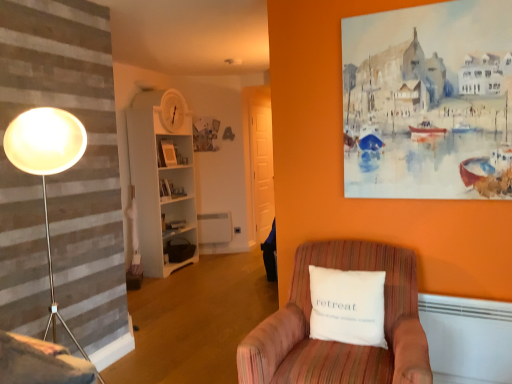
What is the approximate width of white soft cushion at center?

white soft cushion at center is 6.35 inches in width.

What do you see at coordinates (39, 362) in the screenshot? This screenshot has height=384, width=512. I see `velvet pink swivel chair at lower left` at bounding box center [39, 362].

Identify the location of striped fabric armchair at lower right. [x=339, y=342].

Identify the location of swivel chair located on the left of striped fabric armchair at lower right. The width and height of the screenshot is (512, 384). (39, 362).

Considering the points (302, 369) and (2, 359), which point is in front, point (302, 369) or point (2, 359)?

The point (2, 359) is closer to the camera.

Is striped fabric armchair at lower right directly adjacent to velvet pink swivel chair at lower left?

No, striped fabric armchair at lower right is not touching velvet pink swivel chair at lower left.

How distant is striped fabric armchair at lower right from velvet pink swivel chair at lower left?

striped fabric armchair at lower right is 38.07 inches away from velvet pink swivel chair at lower left.

Relative to white wood bookshelf at center, is striped fabric armchair at lower right in front or behind?

striped fabric armchair at lower right is in front of white wood bookshelf at center.

Does striped fabric armchair at lower right appear on the right side of white wood bookshelf at center?

Correct, you'll find striped fabric armchair at lower right to the right of white wood bookshelf at center.

From a real-world perspective, is striped fabric armchair at lower right above or below white wood bookshelf at center?

Clearly, from a real-world perspective, striped fabric armchair at lower right is below white wood bookshelf at center.

From the image's perspective, who appears lower, striped fabric armchair at lower right or white wood bookshelf at center?

From the image's view, striped fabric armchair at lower right is below.

You are a GUI agent. You are given a task and a screenshot of the screen. Output one action in this format:
    pyautogui.click(x=<x>, y=<y>)
    Task: Click on the bookshelf to the left of white soft cushion at center
    The image size is (512, 384).
    Given the screenshot: What is the action you would take?
    pyautogui.click(x=162, y=190)

Is white soft cushion at center to the right of white wood bookshelf at center from the viewer's perspective?

Indeed, white soft cushion at center is positioned on the right side of white wood bookshelf at center.

Which is nearer, (x=324, y=303) or (x=187, y=166)?

Point (x=324, y=303) is closer to the camera than point (x=187, y=166).

Is white soft cushion at center completely or partially outside of white wood bookshelf at center?

Yes, white soft cushion at center is not within white wood bookshelf at center.

Measure the distance between velvet pink swivel chair at lower left and striped fabric armchair at lower right.

velvet pink swivel chair at lower left and striped fabric armchair at lower right are 38.07 inches apart.

Which object is thinner, velvet pink swivel chair at lower left or striped fabric armchair at lower right?

With smaller width is velvet pink swivel chair at lower left.

Considering the positions of objects velvet pink swivel chair at lower left and striped fabric armchair at lower right in the image provided, who is behind, velvet pink swivel chair at lower left or striped fabric armchair at lower right?

velvet pink swivel chair at lower left is further away from the camera.

From a real-world perspective, is velvet pink swivel chair at lower left located beneath striped fabric armchair at lower right?

No, from a real-world perspective, velvet pink swivel chair at lower left is not below striped fabric armchair at lower right.

Is white soft cushion at center taller than striped fabric armchair at lower right?

Incorrect, the height of white soft cushion at center is not larger of that of striped fabric armchair at lower right.

Is white soft cushion at center with striped fabric armchair at lower right?

No, white soft cushion at center is not in contact with striped fabric armchair at lower right.

Is white soft cushion at center at the left side of striped fabric armchair at lower right?

No, white soft cushion at center is not to the left of striped fabric armchair at lower right.

What's the angular difference between white soft cushion at center and striped fabric armchair at lower right's facing directions?

0.0115 degrees separate the facing orientations of white soft cushion at center and striped fabric armchair at lower right.

Is white soft cushion at center taller than velvet pink swivel chair at lower left?

Yes.

Is white soft cushion at center looking in the opposite direction of velvet pink swivel chair at lower left?

No.

From the picture: Could velvet pink swivel chair at lower left be considered to be inside white soft cushion at center?

Definitely not — velvet pink swivel chair at lower left is not inside white soft cushion at center.

From the image's perspective, is white soft cushion at center above or below velvet pink swivel chair at lower left?

Clearly, from the image's perspective, white soft cushion at center is above velvet pink swivel chair at lower left.

Is white wood bookshelf at center located outside striped fabric armchair at lower right?

Yes, white wood bookshelf at center is not within striped fabric armchair at lower right.

You are a GUI agent. You are given a task and a screenshot of the screen. Output one action in this format:
    pyautogui.click(x=<x>, y=<y>)
    Task: Click on the chair below the white wood bookshelf at center (from the image's perspective)
    Image resolution: width=512 pixels, height=384 pixels.
    Given the screenshot: What is the action you would take?
    pyautogui.click(x=339, y=342)

Is white wood bookshelf at center bigger or smaller than striped fabric armchair at lower right?

Clearly, white wood bookshelf at center is larger in size than striped fabric armchair at lower right.

Is white wood bookshelf at center oriented away from striped fabric armchair at lower right?

No, striped fabric armchair at lower right is not at the back of white wood bookshelf at center.

Locate an element on the screen. chair lying on the right of velvet pink swivel chair at lower left is located at coordinates (339, 342).

The width and height of the screenshot is (512, 384). I want to click on chair below the white wood bookshelf at center (from a real-world perspective), so click(339, 342).

Estimate the real-world distances between objects in this image. Which object is further from white wood bookshelf at center, white soft cushion at center or velvet pink swivel chair at lower left?

Among the two, velvet pink swivel chair at lower left is located further to white wood bookshelf at center.

Based on their spatial positions, is striped fabric armchair at lower right or white wood bookshelf at center further from white soft cushion at center?

white wood bookshelf at center.

From the image, which object appears to be nearer to white wood bookshelf at center, white soft cushion at center or striped fabric armchair at lower right?

The object closer to white wood bookshelf at center is striped fabric armchair at lower right.

Which object lies further to the anchor point striped fabric armchair at lower right, white wood bookshelf at center or velvet pink swivel chair at lower left?

white wood bookshelf at center is positioned further to the anchor striped fabric armchair at lower right.

From the picture: Looking at the image, which one is located closer to white soft cushion at center, velvet pink swivel chair at lower left or white wood bookshelf at center?

Based on the image, velvet pink swivel chair at lower left appears to be nearer to white soft cushion at center.

From the image, which object appears to be farther from velvet pink swivel chair at lower left, white soft cushion at center or striped fabric armchair at lower right?

white soft cushion at center is positioned further to the anchor velvet pink swivel chair at lower left.

Looking at the image, which one is located further to white wood bookshelf at center, striped fabric armchair at lower right or white soft cushion at center?

The object further to white wood bookshelf at center is white soft cushion at center.

When comparing their distances from white wood bookshelf at center, does striped fabric armchair at lower right or velvet pink swivel chair at lower left seem further?

velvet pink swivel chair at lower left is positioned further to the anchor white wood bookshelf at center.

The width and height of the screenshot is (512, 384). I want to click on pillow between velvet pink swivel chair at lower left and white wood bookshelf at center from front to back, so click(x=347, y=306).

The image size is (512, 384). Identify the location of chair between velvet pink swivel chair at lower left and white soft cushion at center. (x=339, y=342).

Find the location of a particular element. This screenshot has width=512, height=384. swivel chair between striped fabric armchair at lower right and white wood bookshelf at center in the front-back direction is located at coordinates (39, 362).

Where is `pillow located between striped fabric armchair at lower right and white wood bookshelf at center in the depth direction`? pillow located between striped fabric armchair at lower right and white wood bookshelf at center in the depth direction is located at coordinates (347, 306).